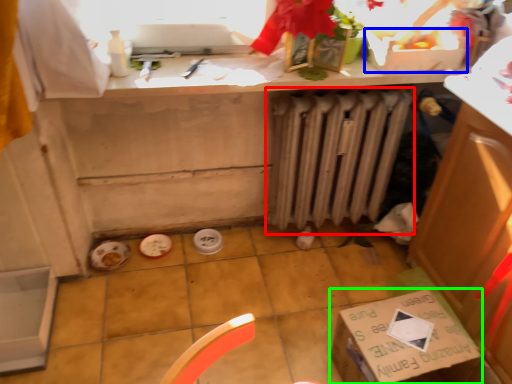
Question: Which object is positioned closest to radiator (highlighted by a red box)? Select from box (highlighted by a blue box) and cardboard box (highlighted by a green box).

Choices:
 (A) box
 (B) cardboard box

Answer: (A)